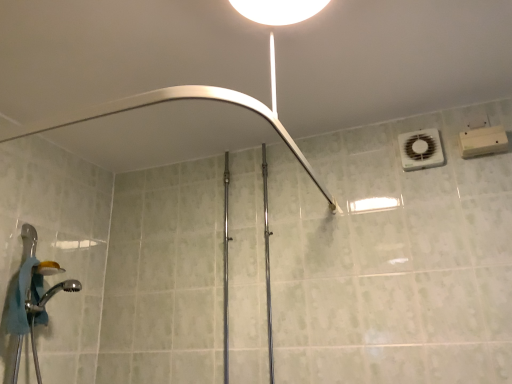
Question: Is chrome metallic shower head at lower left, which is counted as the 2th shower, starting from the top, oriented away from brushed metal shower at upper center, the 1th shower in the top-to-bottom sequence?

Choices:
 (A) no
 (B) yes

Answer: (A)

Question: Is chrome metallic shower head at lower left, the first shower when ordered from bottom to top, to the right of brushed metal shower at upper center, the 1th shower in the top-to-bottom sequence, from the viewer's perspective?

Choices:
 (A) yes
 (B) no

Answer: (B)

Question: From the image's perspective, does chrome metallic shower head at lower left, the first shower when ordered from bottom to top, appear higher than brushed metal shower at upper center, the 1th shower in the top-to-bottom sequence?

Choices:
 (A) no
 (B) yes

Answer: (A)

Question: From a real-world perspective, is chrome metallic shower head at lower left, which is counted as the 2th shower, starting from the top, on brushed metal shower at upper center, the second shower when ordered from bottom to top?

Choices:
 (A) yes
 (B) no

Answer: (B)

Question: Is chrome metallic shower head at lower left, which is counted as the 2th shower, starting from the top, closer to camera compared to brushed metal shower at upper center, the second shower when ordered from bottom to top?

Choices:
 (A) yes
 (B) no

Answer: (B)

Question: Is chrome metallic shower head at lower left, which is counted as the 2th shower, starting from the top, positioned behind brushed metal shower at upper center, the 1th shower in the top-to-bottom sequence?

Choices:
 (A) yes
 (B) no

Answer: (A)

Question: Is brushed metal shower at upper center, the second shower when ordered from bottom to top, touching white plastic air conditioner at upper right?

Choices:
 (A) yes
 (B) no

Answer: (B)

Question: Can you confirm if brushed metal shower at upper center, the second shower when ordered from bottom to top, is bigger than white plastic air conditioner at upper right?

Choices:
 (A) yes
 (B) no

Answer: (A)

Question: Is brushed metal shower at upper center, the 1th shower in the top-to-bottom sequence, oriented away from white plastic air conditioner at upper right?

Choices:
 (A) no
 (B) yes

Answer: (A)

Question: Does brushed metal shower at upper center, the 1th shower in the top-to-bottom sequence, turn towards white plastic air conditioner at upper right?

Choices:
 (A) yes
 (B) no

Answer: (B)

Question: Does brushed metal shower at upper center, the 1th shower in the top-to-bottom sequence, contain white plastic air conditioner at upper right?

Choices:
 (A) no
 (B) yes

Answer: (A)

Question: Can you confirm if brushed metal shower at upper center, the second shower when ordered from bottom to top, is smaller than white plastic air conditioner at upper right?

Choices:
 (A) yes
 (B) no

Answer: (B)

Question: Does chrome metallic shower head at lower left, the first shower when ordered from bottom to top, have a smaller size compared to white glossy light fixture at upper center?

Choices:
 (A) yes
 (B) no

Answer: (A)